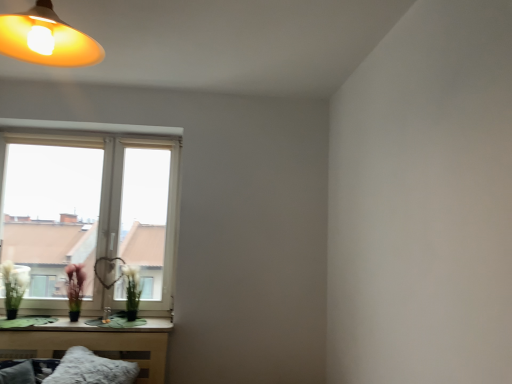
Question: Is fuzzy white pillow at lower left outside green matte vase at lower left?

Choices:
 (A) yes
 (B) no

Answer: (A)

Question: Is fuzzy white pillow at lower left directly adjacent to green matte vase at lower left?

Choices:
 (A) yes
 (B) no

Answer: (B)

Question: From a real-world perspective, is fuzzy white pillow at lower left located higher than green matte vase at lower left?

Choices:
 (A) yes
 (B) no

Answer: (B)

Question: From a real-world perspective, is fuzzy white pillow at lower left below green matte vase at lower left?

Choices:
 (A) no
 (B) yes

Answer: (B)

Question: From the image's perspective, would you say fuzzy white pillow at lower left is shown under green matte vase at lower left?

Choices:
 (A) no
 (B) yes

Answer: (B)

Question: Can you confirm if fuzzy white pillow at lower left is smaller than green matte vase at lower left?

Choices:
 (A) yes
 (B) no

Answer: (B)

Question: Considering the relative sizes of green matte vase at lower left and fuzzy white pillow at lower left in the image provided, is green matte vase at lower left bigger than fuzzy white pillow at lower left?

Choices:
 (A) yes
 (B) no

Answer: (B)

Question: Is fuzzy white pillow at lower left inside green matte vase at lower left?

Choices:
 (A) no
 (B) yes

Answer: (A)

Question: Does green matte vase at lower left lie in front of fuzzy white pillow at lower left?

Choices:
 (A) no
 (B) yes

Answer: (A)

Question: Is green matte vase at lower left further to the viewer compared to fuzzy white pillow at lower left?

Choices:
 (A) yes
 (B) no

Answer: (A)

Question: Is green matte vase at lower left to the right of fuzzy white pillow at lower left from the viewer's perspective?

Choices:
 (A) no
 (B) yes

Answer: (A)

Question: Considering the relative sizes of green matte vase at lower left and fuzzy white pillow at lower left in the image provided, is green matte vase at lower left thinner than fuzzy white pillow at lower left?

Choices:
 (A) no
 (B) yes

Answer: (B)

Question: Considering the relative sizes of green matte plant at window, arranged as the 2th flower when viewed from the left, and fuzzy white pillow at lower left in the image provided, is green matte plant at window, arranged as the 2th flower when viewed from the left, thinner than fuzzy white pillow at lower left?

Choices:
 (A) yes
 (B) no

Answer: (A)